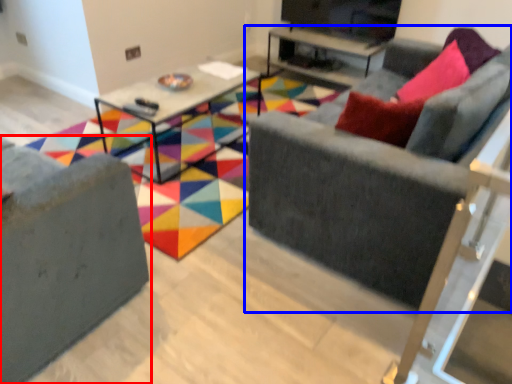
Question: Which object appears closest to the camera in this image, studio couch (highlighted by a red box) or studio couch (highlighted by a blue box)?

Choices:
 (A) studio couch
 (B) studio couch

Answer: (A)